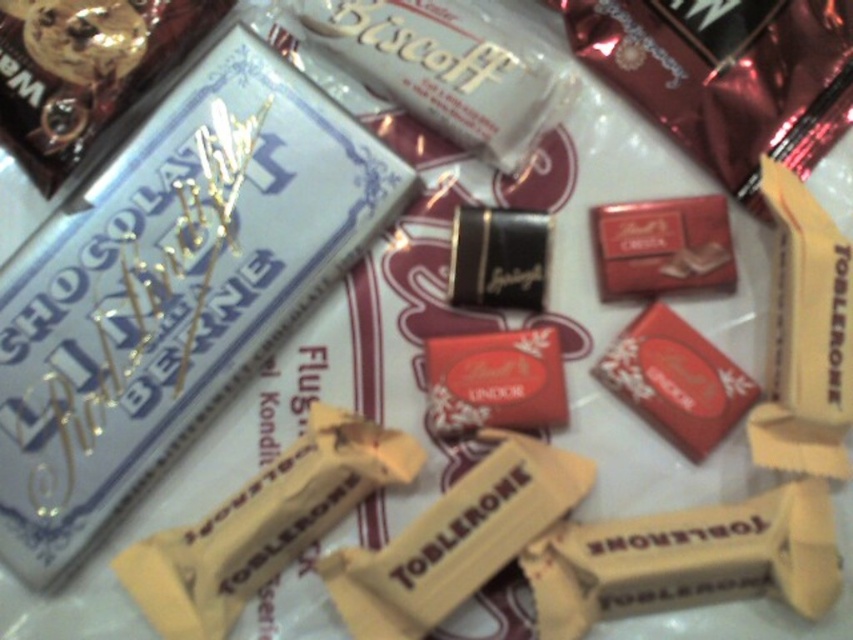
You are a customer at a store and see both the shiny red chocolate bar at center and the shiny dark chocolate bar at center displayed on the table. Which chocolate bar is shorter in height?

The shiny red chocolate bar at center is not as tall as the shiny dark chocolate bar at center, so the shiny red chocolate bar at center is shorter in height.

You are standing at a distance of 4 feet from a table with chocolates. You want to reach a point marked as point (619, 291) on the table. Is the point within your reach if you can extend your arm 3.8 feet?

The distance between point (619, 291) and the viewer is 3.93 feet. Since your arm can only extend 3.8 feet, you cannot reach the point (619, 291) on the table.